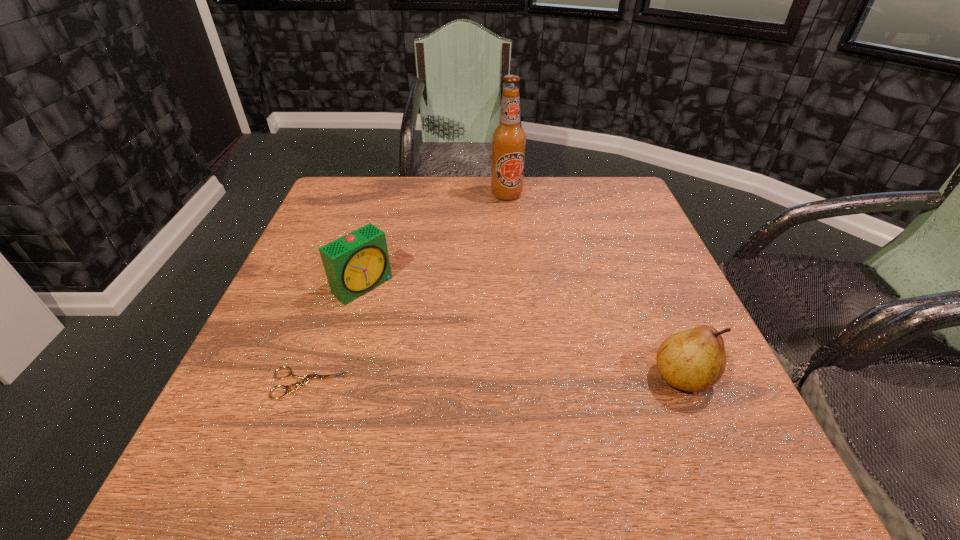
Locate an element on the screen. This screenshot has height=540, width=960. object that is at the near right corner is located at coordinates (693, 360).

The width and height of the screenshot is (960, 540). What are the coordinates of `blank space at the far edge of the desktop` in the screenshot? It's located at (579, 201).

Image resolution: width=960 pixels, height=540 pixels. I want to click on vacant position at the near edge of the desktop, so click(x=579, y=418).

In the image, there is a desktop. Where is `vacant area at the left edge`? The image size is (960, 540). vacant area at the left edge is located at coordinates (317, 280).

The height and width of the screenshot is (540, 960). In order to click on free spot at the right edge of the desktop in this screenshot , I will do `click(650, 274)`.

In the image, there is a desktop. Where is `blank space at the far left corner`? blank space at the far left corner is located at coordinates (378, 193).

In the image, there is a desktop. Identify the location of vacant space at the far right corner. (596, 205).

Find the location of a particular element. This screenshot has height=540, width=960. vacant space at the near right corner of the desktop is located at coordinates (655, 404).

Where is `free space between the shortest object and the alarm clock`? free space between the shortest object and the alarm clock is located at coordinates (336, 335).

Where is `blank region between the shortest object and the beer bottle`? This screenshot has height=540, width=960. blank region between the shortest object and the beer bottle is located at coordinates (407, 289).